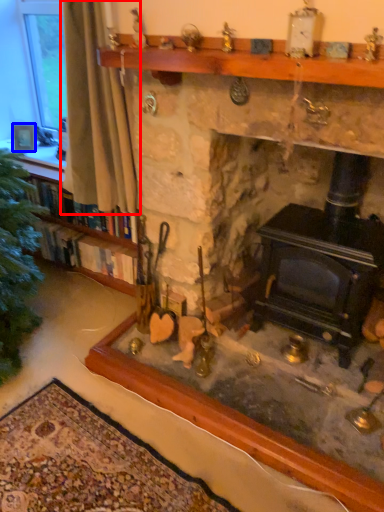
Question: Among these objects, which one is nearest to the camera, curtain (highlighted by a red box) or picture frame (highlighted by a blue box)?

Choices:
 (A) curtain
 (B) picture frame

Answer: (A)